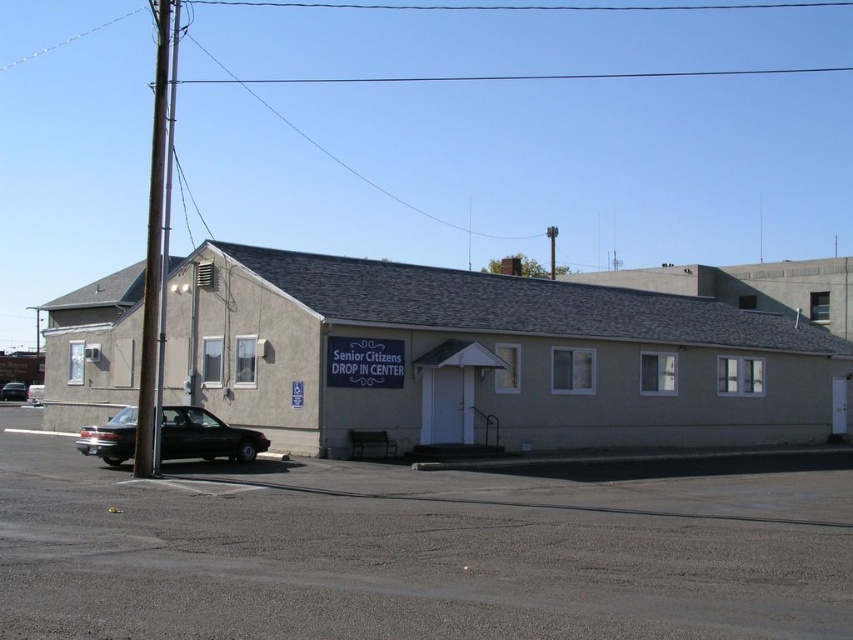
Question: Which of these objects is positioned farthest from the shiny black sedan at center?

Choices:
 (A) gray asphalt parking lot at lower left
 (B) shiny black sedan at lower left

Answer: (A)

Question: Is the position of gray asphalt parking lot at lower left more distant than that of shiny black sedan at lower left?

Choices:
 (A) yes
 (B) no

Answer: (B)

Question: Considering the real-world distances, which object is farthest from the shiny black sedan at lower left?

Choices:
 (A) gray asphalt parking lot at lower left
 (B) shiny black sedan at center

Answer: (B)

Question: Which point is closer to the camera?

Choices:
 (A) shiny black sedan at center
 (B) shiny black sedan at lower left
 (C) gray asphalt parking lot at lower left

Answer: (C)

Question: Can you confirm if shiny black sedan at lower left is thinner than shiny black sedan at center?

Choices:
 (A) no
 (B) yes

Answer: (B)

Question: Does gray asphalt parking lot at lower left come in front of shiny black sedan at lower left?

Choices:
 (A) yes
 (B) no

Answer: (A)